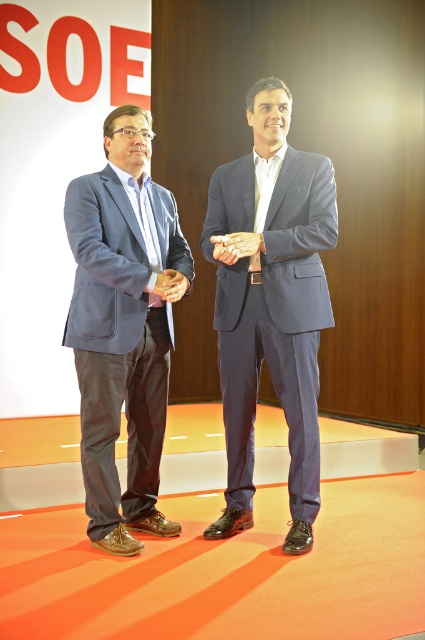
You are a photographer standing at the center of the stage. You need to adjust your camera to focus on the matte gray suit at left. What are the coordinates where you should aim your camera?

You should aim your camera at the coordinates point (122,328) to focus on the matte gray suit at left.

You are an event planner looking at the stage setup. You notice a point marked at coordinates (x=271, y=301). Based on the scene description, what object is located at that point?

The point at coordinates (x=271, y=301) indicates the location of the matte gray suit at center.

You are a photographer adjusting your camera settings to capture the scene. You notice a matte gray suit at center located at point (271, 301). What is the position of the matte gray suit at center relative to the two men on the stage?

The matte gray suit at center is positioned at point (271, 301), which is at the center of the image, between the two men on the stage.